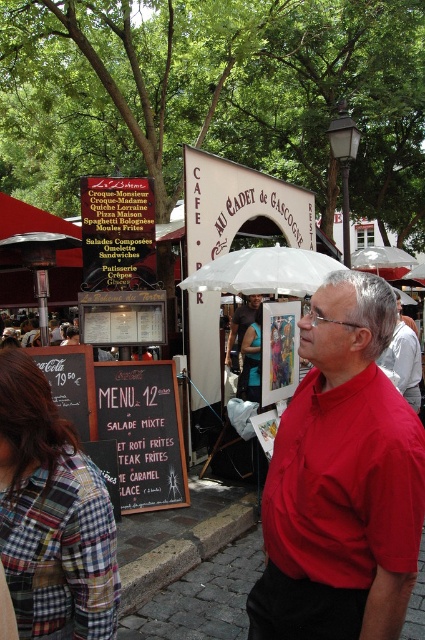
You are a customer at the cafe and want to read the black chalkboard menu at lower left while standing near the matte red shirt at center. Is the menu visible from your current position?

The black chalkboard menu at lower left is positioned under the matte red shirt at center, so it might be blocked by the shirt and not fully visible.

You are a photographer trying to capture both the red smooth shirt at center and the plaid fabric shirt at lower left in a single shot. Which shirt should you focus on first to ensure both are in focus?

You should focus on the red smooth shirt at center first because it is closer to the viewer than the plaid fabric shirt at lower left, so focusing on the closer object will help keep both in focus.

You are standing at the entrance of the CAF AU CADET de GASCOGNE and see two points marked in the scene. The first point is at coordinate point (x=90, y=516) and the second is at point (x=410, y=401). Which point is closer to you?

Point (x=90, y=516) is in front of point (x=410, y=401), so it is closer to you.